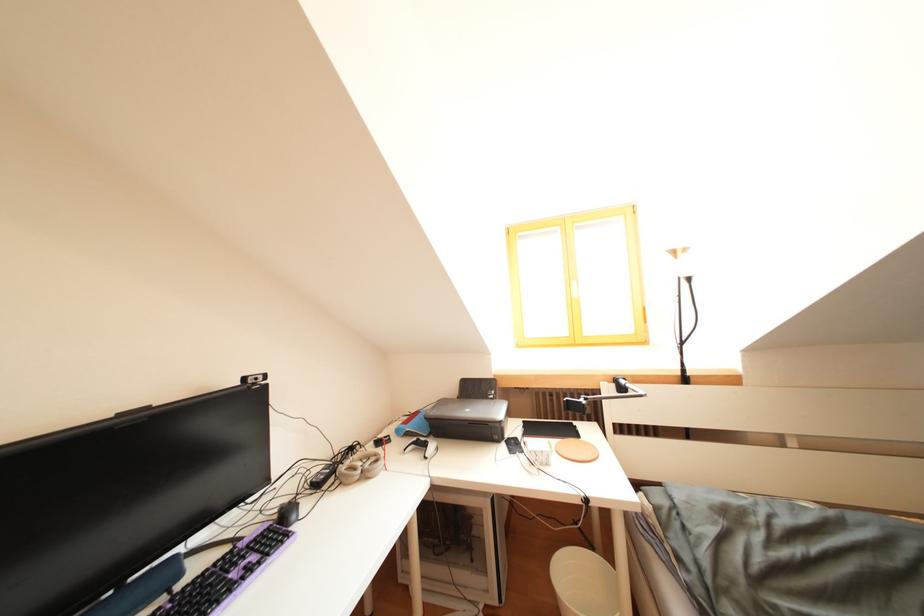
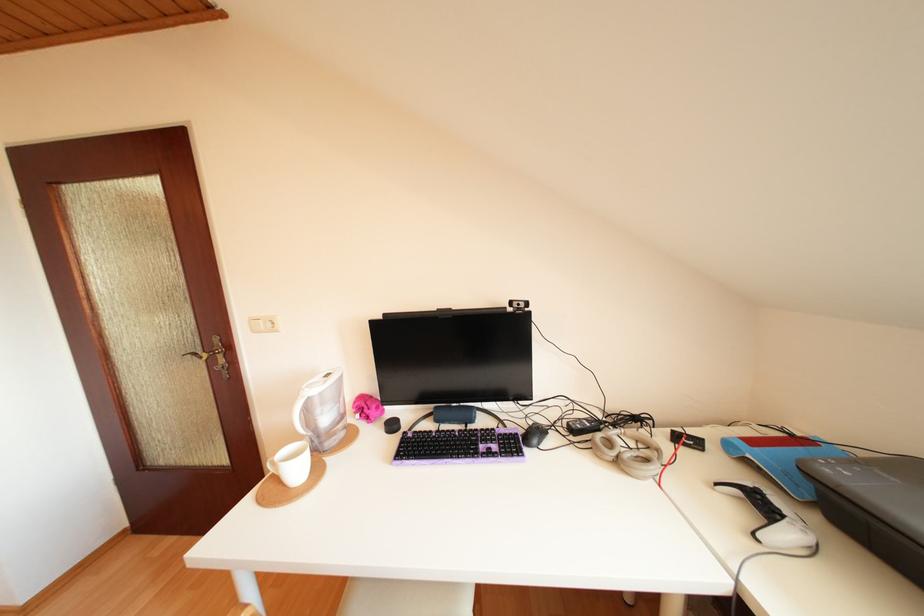
Question: The camera is either moving clockwise (left) or counter-clockwise (right) around the object. The first image is from the beginning of the video and the second image is from the end. Is the camera moving left or right when shooting the video?

Choices:
 (A) Left
 (B) Right

Answer: (B)